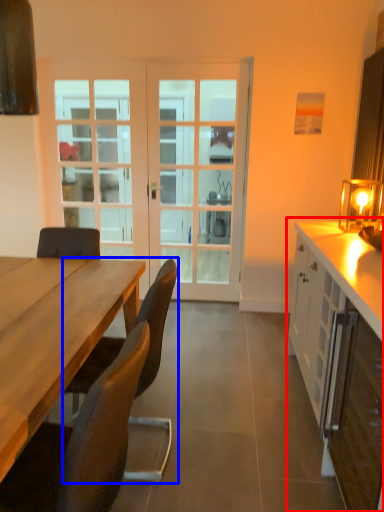
Question: Which of the following is the farthest to the observer, cabinetry (highlighted by a red box) or chair (highlighted by a blue box)?

Choices:
 (A) cabinetry
 (B) chair

Answer: (A)